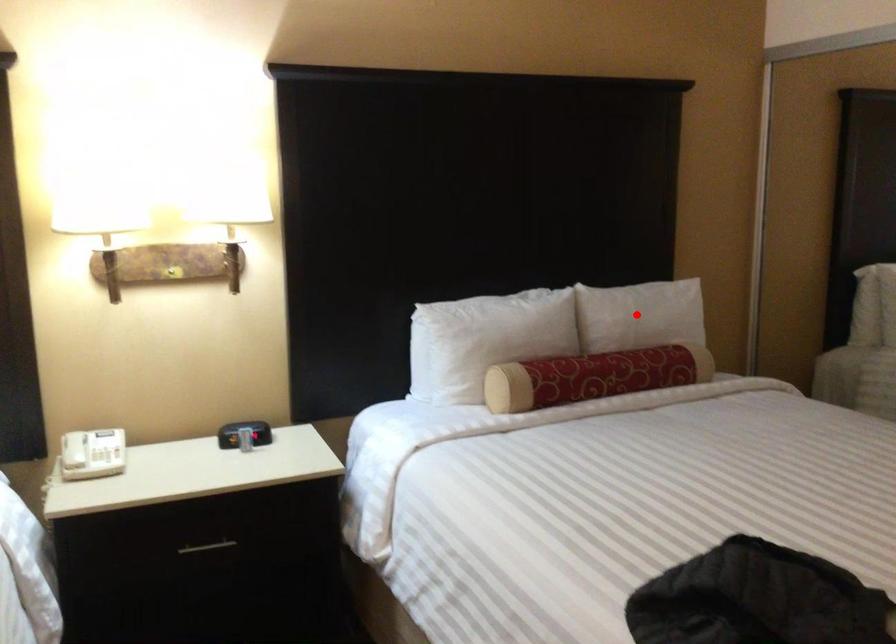
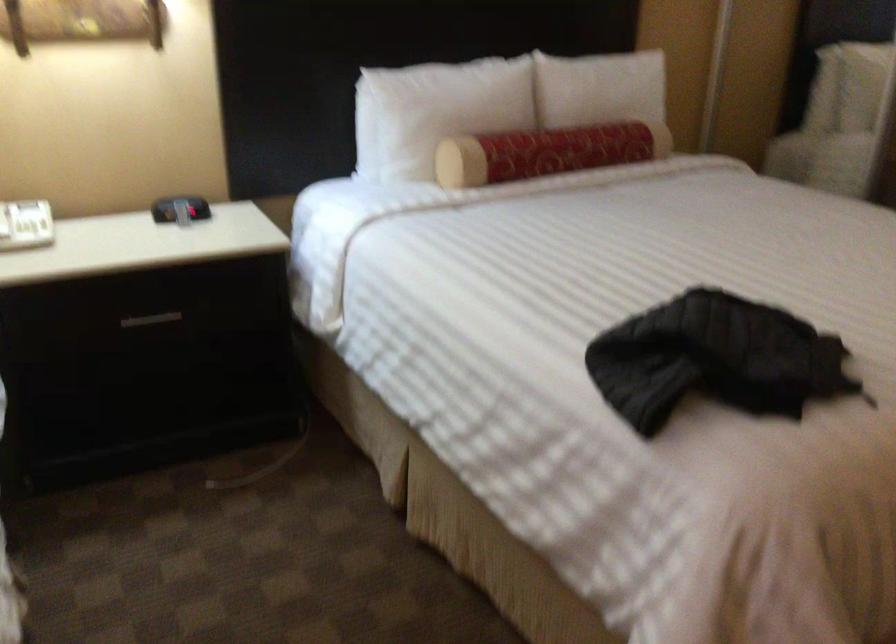
Find the pixel in the second image that matches the highlighted location in the first image.

(599, 88)